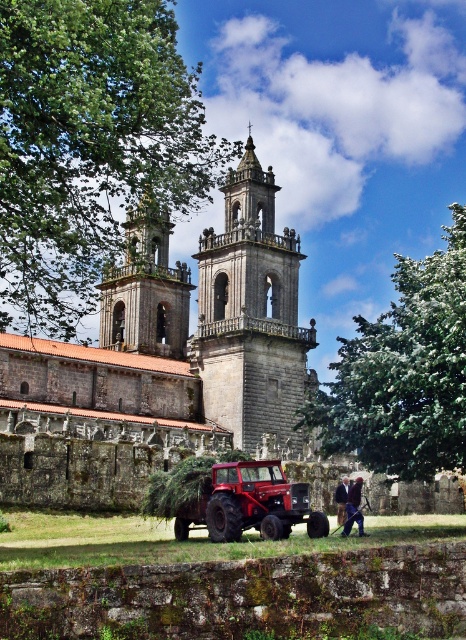
You are standing in front of the historic stone church and notice two jackets. Which jacket, the brown leather jacket at center or the dark brown leather jacket at lower center, is positioned to the left?

The brown leather jacket at center is positioned to the left of the dark brown leather jacket at lower center.

You are a photographer planning to capture the stone church at center and the brown leather jacket at center in a single frame. Given that your camera can only focus on objects within a 100m height range, will both objects be in focus?

The stone church at center is taller than the brown leather jacket at center, but since the camera can focus on objects within a 100m height range, both will be in focus as their height difference is likely within that range.

You are standing in front of the historic stone church and notice two jackets. The brown leather jacket at center and the dark brown leather jacket at lower center. Which jacket is closer to you?

The brown leather jacket at center is closer to you because it is shorter than the dark brown leather jacket at lower center, which means it is positioned in front.